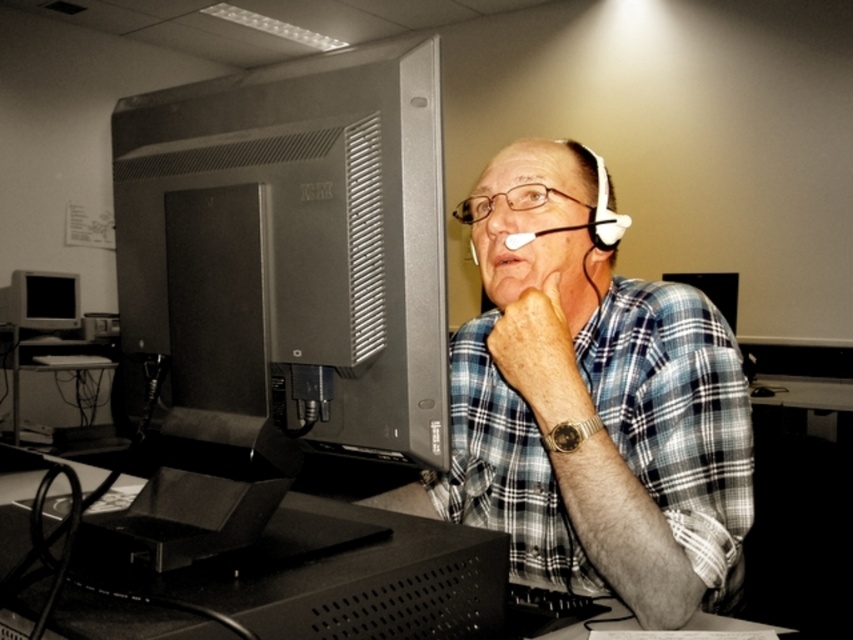
Question: Among these objects, which one is nearest to the camera?

Choices:
 (A) matte skin at center
 (B) matte skin nose at center

Answer: (B)

Question: Does metallic gray computer desk at lower left have a greater width compared to matte skin nose at center?

Choices:
 (A) yes
 (B) no

Answer: (A)

Question: Does metallic gray monitor at center-left appear on the right side of matte black monitor at left?

Choices:
 (A) no
 (B) yes

Answer: (B)

Question: Estimate the real-world distances between objects in this image. Which object is closer to the metallic gray monitor at center-left?

Choices:
 (A) matte skin nose at center
 (B) matte black monitor at left

Answer: (A)

Question: Is plaid shirt at center behind metallic gray computer desk at lower left?

Choices:
 (A) no
 (B) yes

Answer: (A)

Question: Which is farther from the plaid shirt at center?

Choices:
 (A) matte skin at center
 (B) clear plastic glasses at center
 (C) matte black monitor at center
 (D) matte black monitor at left

Answer: (D)